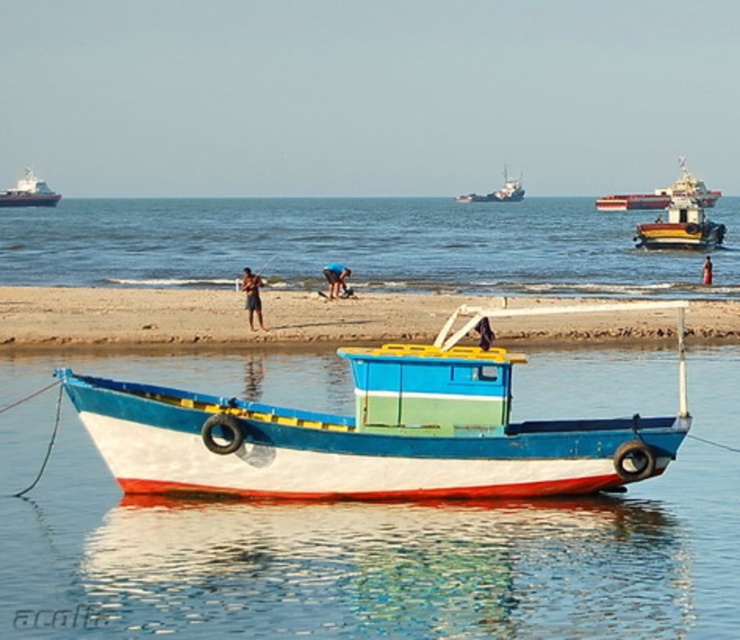
Measure the distance between wooden polished boat at right and skinny man at beach.

wooden polished boat at right and skinny man at beach are 9.62 meters apart.

Consider the image. Does wooden polished boat at right appear under skinny man at beach?

Actually, wooden polished boat at right is above skinny man at beach.

What do you see at coordinates (679, 228) in the screenshot?
I see `wooden polished boat at right` at bounding box center [679, 228].

Find the location of `wooden polished boat at right`. wooden polished boat at right is located at coordinates pyautogui.click(x=679, y=228).

Which is above, reddish-orange metallic ship at upper right or tan skin human at center?

reddish-orange metallic ship at upper right

Who is more forward, (659, 196) or (258, 307)?

Point (258, 307) is more forward.

Between point (635, 196) and point (259, 308), which one is positioned behind?

The point (635, 196) is behind.

Identify the location of reddish-orange metallic ship at upper right. click(659, 195).

Locate an element on the screen. reddish-orange metallic ship at upper right is located at coordinates (659, 195).

Which of these two, reddish-orange metallic ship at upper right or skinny man at beach, stands taller?

reddish-orange metallic ship at upper right

Who is more forward, (662, 200) or (706, 262)?

Point (706, 262) is in front.

Where is `reddish-orange metallic ship at upper right`? reddish-orange metallic ship at upper right is located at coordinates (659, 195).